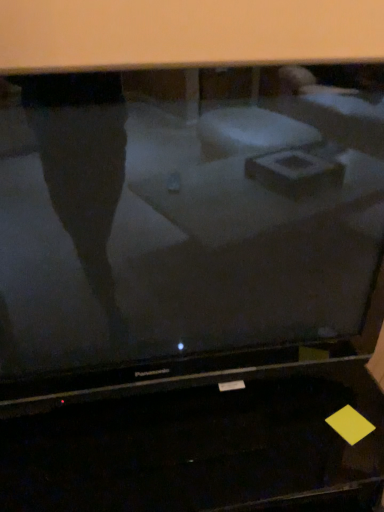
Identify the location of vacant area on top of black glossy desktop at lower center (from a real-world perspective). (187, 436).